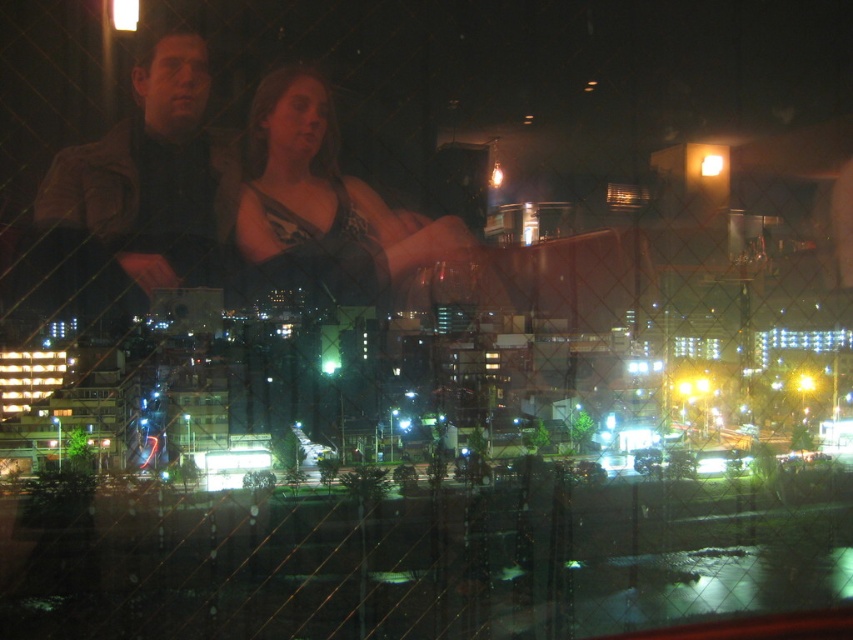
Who is lower down, brown leather jacket at left or satin black dress at center?

satin black dress at center is below.

Does brown leather jacket at left appear over satin black dress at center?

Yes, brown leather jacket at left is above satin black dress at center.

Is point (219, 188) closer to camera compared to point (465, 250)?

Yes, it is.

Image resolution: width=853 pixels, height=640 pixels. I want to click on brown leather jacket at left, so pyautogui.click(x=154, y=177).

Can you confirm if satin black dress at center is positioned below transparent glass window at center?

Incorrect, satin black dress at center is not positioned below transparent glass window at center.

Who is higher up, satin black dress at center or transparent glass window at center?

satin black dress at center

You are a GUI agent. You are given a task and a screenshot of the screen. Output one action in this format:
    pyautogui.click(x=<x>, y=<y>)
    Task: Click on the satin black dress at center
    This screenshot has width=853, height=640.
    Given the screenshot: What is the action you would take?
    pyautogui.click(x=323, y=204)

The image size is (853, 640). What do you see at coordinates (236, 189) in the screenshot? I see `leather jacket at center` at bounding box center [236, 189].

Is leather jacket at center closer to the viewer compared to satin black dress at center?

Yes, leather jacket at center is in front of satin black dress at center.

The height and width of the screenshot is (640, 853). I want to click on leather jacket at center, so click(x=236, y=189).

Identify the location of leather jacket at center. This screenshot has width=853, height=640. (236, 189).